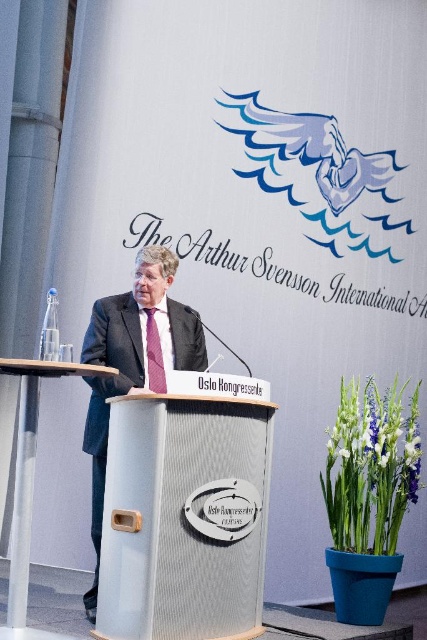
Question: Which object appears closest to the camera in this image?

Choices:
 (A) pink satin tie at center
 (B) dark gray suit at center

Answer: (B)

Question: Which object is positioned farthest from the matte silver podium at center?

Choices:
 (A) pink satin tie at center
 (B) dark gray suit at center

Answer: (A)

Question: Is the position of matte silver podium at center more distant than that of dark gray suit at center?

Choices:
 (A) yes
 (B) no

Answer: (B)

Question: Can you confirm if matte silver podium at center is positioned above dark gray suit at center?

Choices:
 (A) no
 (B) yes

Answer: (A)

Question: Where is matte silver podium at center located in relation to dark gray suit at center in the image?

Choices:
 (A) left
 (B) right

Answer: (B)

Question: Which point appears closest to the camera in this image?

Choices:
 (A) (140, 321)
 (B) (160, 372)

Answer: (B)